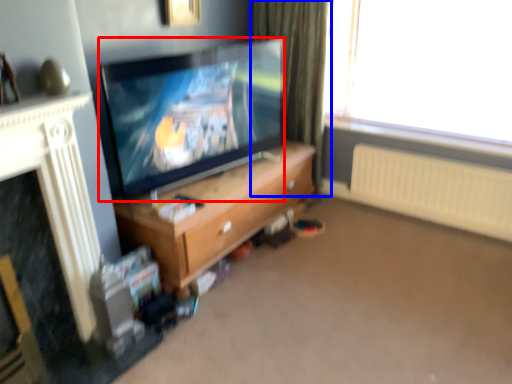
Question: Which object is further to the camera taking this photo, television (highlighted by a red box) or curtain (highlighted by a blue box)?

Choices:
 (A) television
 (B) curtain

Answer: (B)